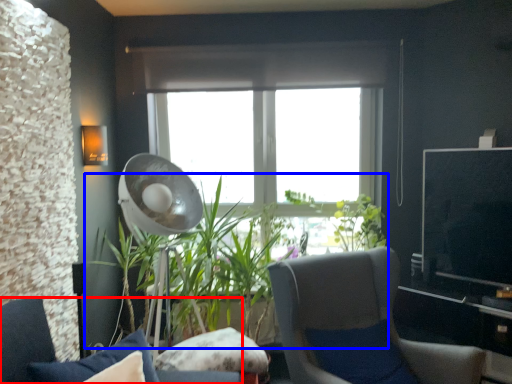
Question: Which object is closer to the camera taking this photo, chair (highlighted by a red box) or houseplant (highlighted by a blue box)?

Choices:
 (A) chair
 (B) houseplant

Answer: (A)